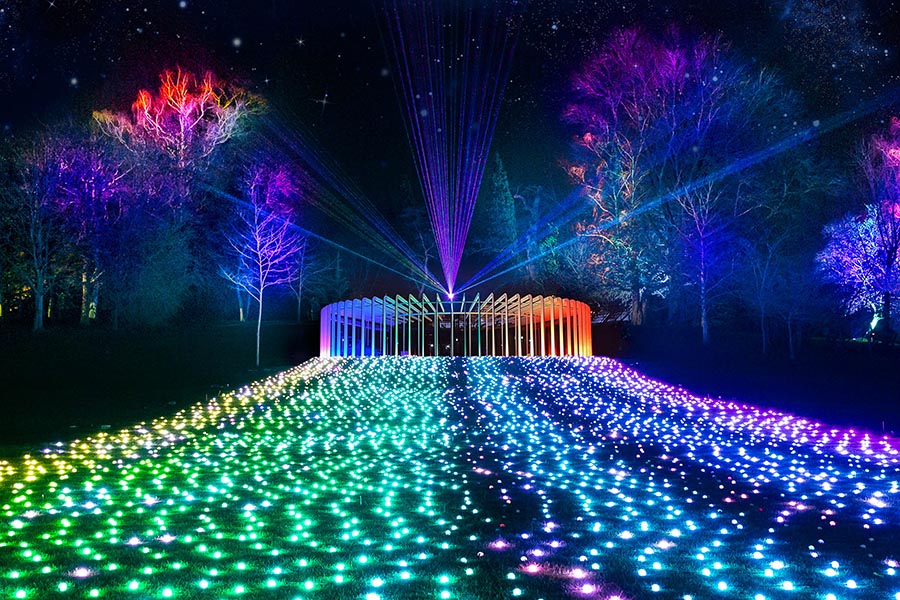
At what (x,y) coordinates should I click in order to perform the action: click on two sections of lights. Please return your answer as a coordinate pair (x, y). The image size is (900, 600). Looking at the image, I should click on (328, 466), (598, 493).